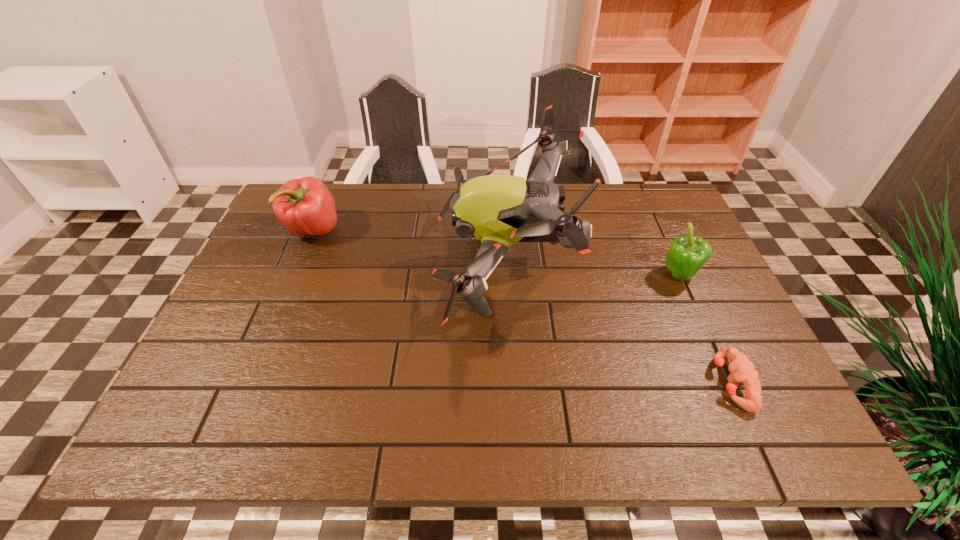
Where is `object located at the far left corner`? object located at the far left corner is located at coordinates (305, 207).

Locate an element on the screen. This screenshot has height=540, width=960. object situated at the near right corner is located at coordinates (742, 371).

The height and width of the screenshot is (540, 960). In the image, there is a desktop. Identify the location of free region at the far edge. (416, 195).

The height and width of the screenshot is (540, 960). Find the location of `vacant space at the near edge of the desktop`. vacant space at the near edge of the desktop is located at coordinates (311, 443).

At what (x,y) coordinates should I click in order to perform the action: click on free space at the left edge of the desktop. Please return your answer as a coordinate pair (x, y). Looking at the image, I should click on (243, 302).

Find the location of a particular element. The image size is (960, 540). free space at the right edge of the desktop is located at coordinates (647, 249).

This screenshot has width=960, height=540. Identify the location of vacant region at the far right corner of the desktop. (628, 214).

Identify the location of empty location between the tallest object and the nearer bell pepper. The image size is (960, 540). [591, 269].

Find the location of a particular element. The height and width of the screenshot is (540, 960). free space between the shortest object and the nearer bell pepper is located at coordinates (706, 329).

This screenshot has width=960, height=540. I want to click on blank region between the right bell pepper and the drone, so click(x=591, y=269).